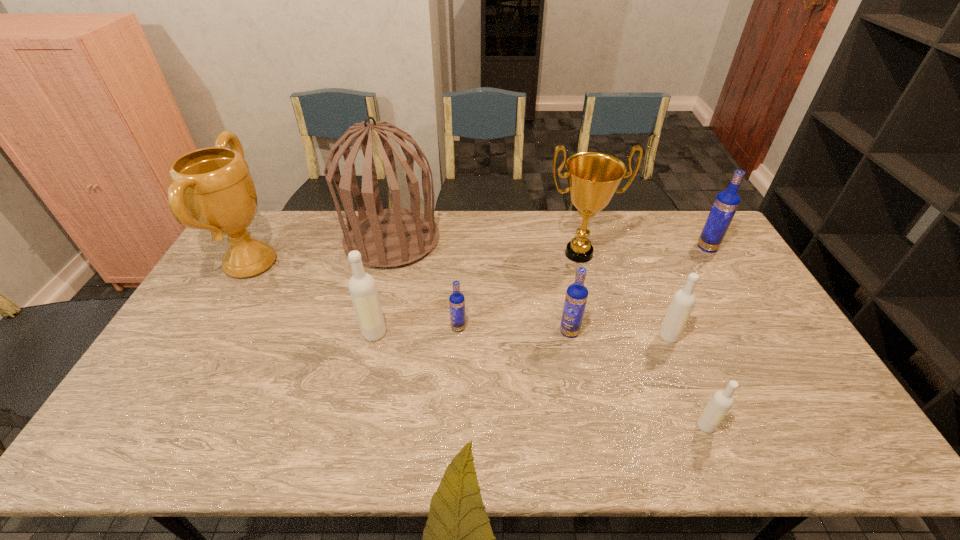
This screenshot has width=960, height=540. I want to click on brown birdcage, so click(385, 238).

Locate an element on the screen. gold award is located at coordinates click(x=593, y=178).

Locate an element on the screen. The image size is (960, 540). the leftmost object is located at coordinates (214, 185).

Locate an element on the screen. The width and height of the screenshot is (960, 540). the farthest blue vodka is located at coordinates (726, 203).

This screenshot has height=540, width=960. In order to click on the farthest vodka in this screenshot , I will do `click(726, 203)`.

The height and width of the screenshot is (540, 960). What are the coordinates of `the leftmost vodka` in the screenshot? It's located at coord(362,287).

Identify the location of the biggest white vodka. This screenshot has height=540, width=960. (362, 287).

The width and height of the screenshot is (960, 540). Find the location of `the second smallest white vodka`. the second smallest white vodka is located at coordinates (683, 301).

The height and width of the screenshot is (540, 960). In order to click on the second smallest blue vodka in this screenshot , I will do `click(576, 296)`.

Image resolution: width=960 pixels, height=540 pixels. In order to click on the second blue vodka from left to right in this screenshot , I will do click(576, 296).